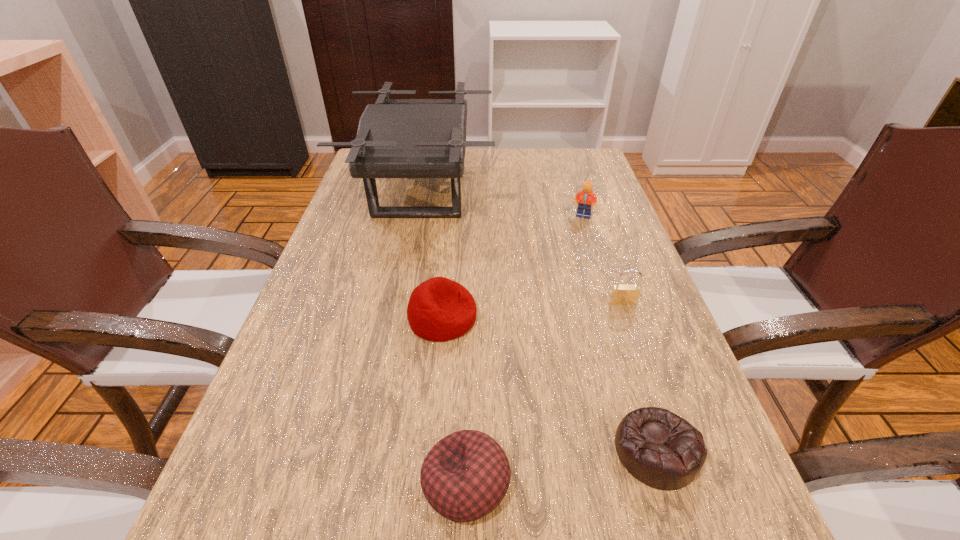
Where is `vacant space located on the back of the rightmost beanbag`? The height and width of the screenshot is (540, 960). vacant space located on the back of the rightmost beanbag is located at coordinates (625, 351).

You are a GUI agent. You are given a task and a screenshot of the screen. Output one action in this format:
    pyautogui.click(x=<x>, y=<y>)
    Task: Click on the object that is at the far edge
    
    Given the screenshot: What is the action you would take?
    pyautogui.click(x=397, y=138)

Locate an element on the screen. The image size is (960, 540). object situated at the left edge is located at coordinates (397, 138).

You are a GUI agent. You are given a task and a screenshot of the screen. Output one action in this format:
    pyautogui.click(x=<x>, y=<y>)
    Task: Click on the Lego present at the right edge
    The width and height of the screenshot is (960, 540).
    Given the screenshot: What is the action you would take?
    pyautogui.click(x=585, y=198)

Identify the location of padlock that is at the right edge. The image size is (960, 540). (625, 294).

You are a GUI agent. You are given a task and a screenshot of the screen. Output one action in this format:
    pyautogui.click(x=<x>, y=<y>)
    Task: Click on the beanbag that is at the right edge
    The width and height of the screenshot is (960, 540).
    Given the screenshot: What is the action you would take?
    pyautogui.click(x=662, y=450)

At what (x,y) coordinates should I click in order to perform the action: click on object present at the far left corner. Please return your answer as a coordinate pair (x, y). This screenshot has width=960, height=540. Looking at the image, I should click on (397, 138).

Locate an element on the screen. The height and width of the screenshot is (540, 960). vacant space at the far edge of the desktop is located at coordinates (473, 157).

Image resolution: width=960 pixels, height=540 pixels. I want to click on free space at the left edge, so click(x=344, y=218).

What are the coordinates of `vacant space at the right edge of the desktop` in the screenshot? It's located at (606, 220).